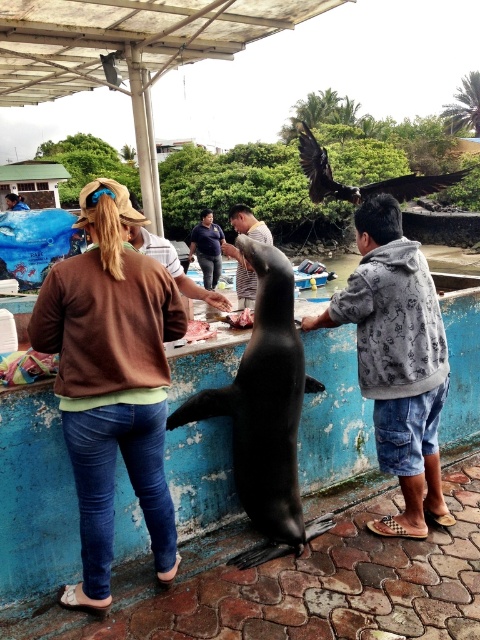
Between point (409, 252) and point (135, 202), which one is positioned behind?

Positioned behind is point (135, 202).

Does gray printed hoodie at center appear on the right side of dark blue jeans at center?

Correct, you'll find gray printed hoodie at center to the right of dark blue jeans at center.

What are the coordinates of `gray printed hoodie at center` in the screenshot? It's located at (396, 358).

Between point (192, 321) and point (13, 204), which one is positioned in front?

Point (192, 321) is more forward.

Where is `smooth pinkish-red fish at center`? smooth pinkish-red fish at center is located at coordinates (199, 330).

How far apart are brown cotton sweater at upper left and brown leather hat at upper left?

The distance of brown cotton sweater at upper left from brown leather hat at upper left is 19.00 meters.

Where is `brown cotton sweater at upper left`? brown cotton sweater at upper left is located at coordinates (111, 380).

Is point (184, 321) positioned after point (4, 196)?

That is False.

In order to click on brown cotton sweater at upper left in this screenshot , I will do `click(111, 380)`.